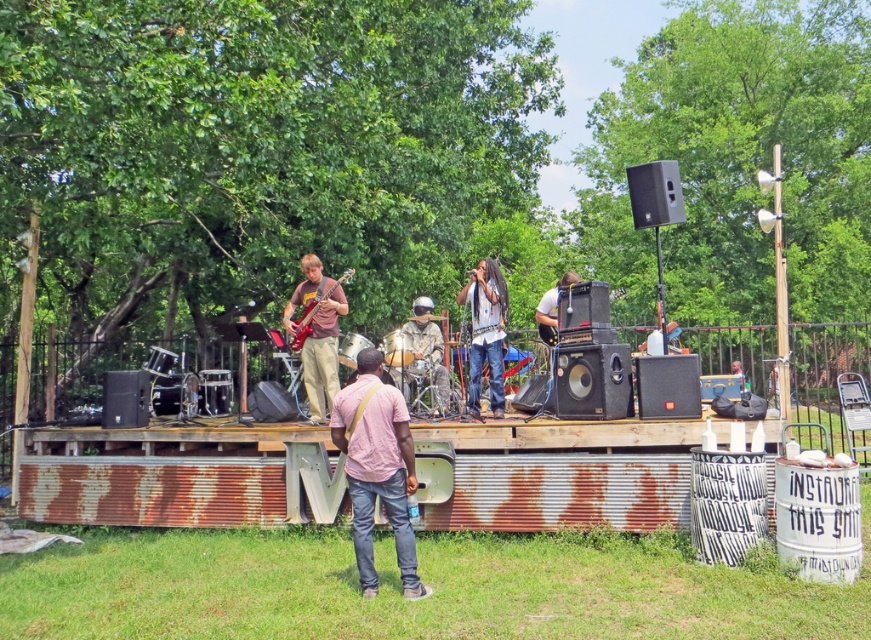
Is matte brown guitar at center shorter than glossy electric guitar at left?

No.

Is matte brown guitar at center wider than glossy electric guitar at left?

In fact, matte brown guitar at center might be narrower than glossy electric guitar at left.

Is point (315, 369) in front of point (300, 332)?

No, it is behind (300, 332).

This screenshot has height=640, width=871. Find the location of `matte brown guitar at center`. matte brown guitar at center is located at coordinates (316, 333).

Who is taller, denim pants at center or glossy electric guitar at left?

denim pants at center is taller.

Does denim pants at center appear over glossy electric guitar at left?

No, denim pants at center is not above glossy electric guitar at left.

This screenshot has height=640, width=871. What do you see at coordinates (485, 332) in the screenshot?
I see `denim pants at center` at bounding box center [485, 332].

Find the location of a particular element. The image size is (871, 640). denim pants at center is located at coordinates (485, 332).

Can you confirm if denim pants at center is positioned to the left of matte black guitar at center?

Yes, denim pants at center is to the left of matte black guitar at center.

Is point (495, 321) more distant than point (554, 285)?

That is False.

Measure the distance between point [463,294] and camera.

Point [463,294] is 8.82 meters away from camera.

Locate an element on the screen. denim pants at center is located at coordinates (485, 332).